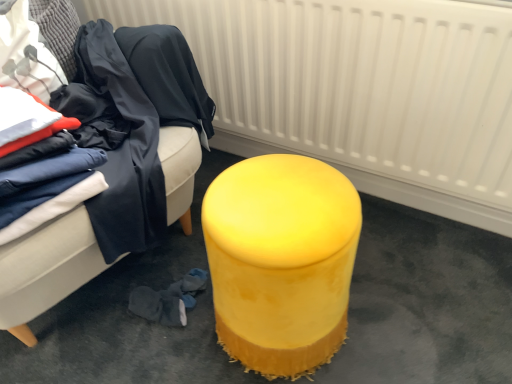
This screenshot has height=384, width=512. What are the coordinates of `vacant space that is to the left of yellow velvet ottoman at center` in the screenshot? It's located at 161,349.